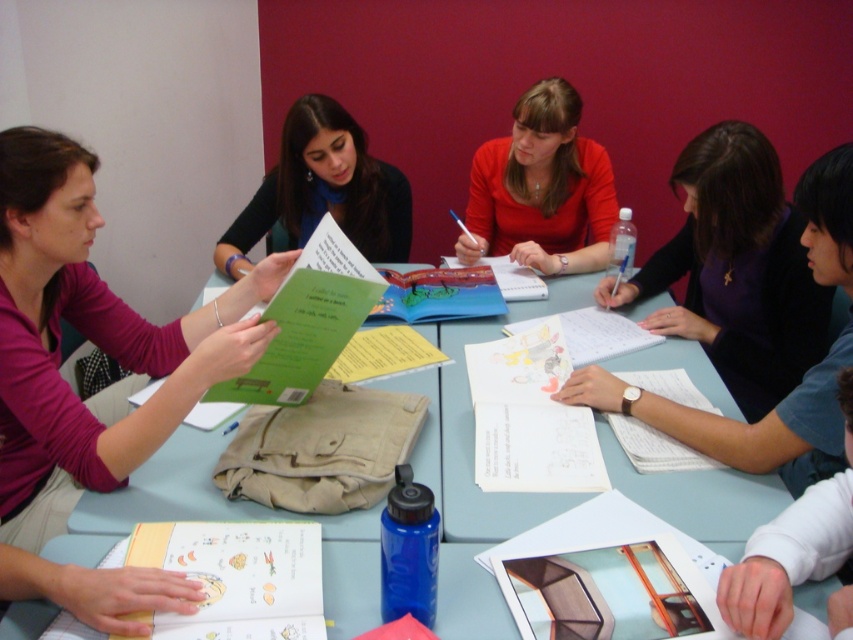
Question: Which object is closer to the camera taking this photo?

Choices:
 (A) green paper at center
 (B) white paper at lower right
 (C) paper with illustrations at center

Answer: (C)

Question: Which of the following is the farthest from the observer?

Choices:
 (A) (167, 529)
 (B) (271, 358)
 (C) (520, 150)

Answer: (C)

Question: Considering the relative positions of light blue plastic table at center and purple matte shirt at upper right in the image provided, where is light blue plastic table at center located with respect to purple matte shirt at upper right?

Choices:
 (A) right
 (B) left

Answer: (B)

Question: Among these objects, which one is nearest to the camera?

Choices:
 (A) paper with illustrations at center
 (B) white paper at lower right
 (C) light blue plastic table at center
 (D) blue plastic bottle at lower center

Answer: (A)

Question: Can you confirm if matte green book at center is smaller than white paper at lower right?

Choices:
 (A) no
 (B) yes

Answer: (A)

Question: Is matte red shirt at center to the right of green paper at center from the viewer's perspective?

Choices:
 (A) no
 (B) yes

Answer: (B)